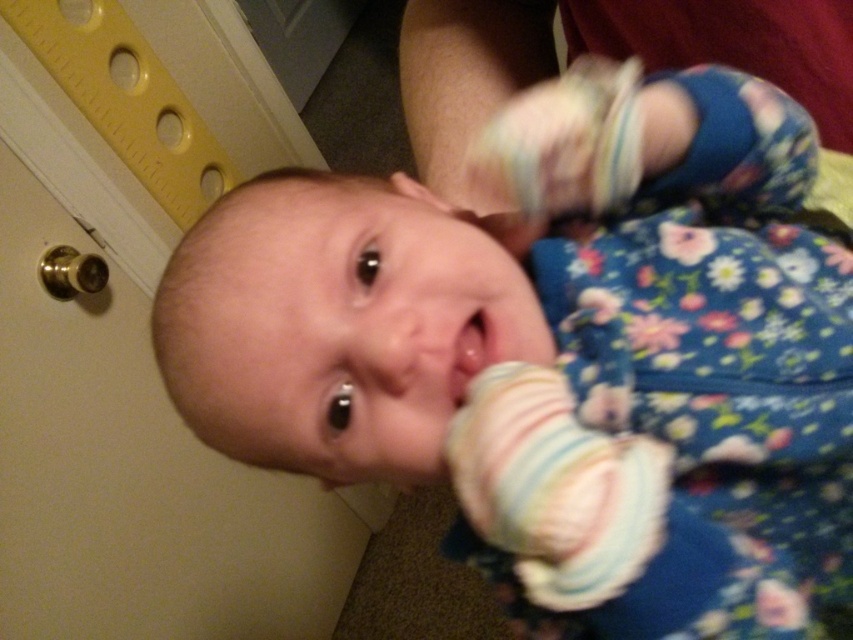
You are a photographer taking a closeup shot of a baby. You notice the floral fabric baby foot at center and the smooth flesh mouth at center. From the baby s perspective, which object is on the left side?

The smooth flesh mouth at center is on the left side from the baby s perspective because the floral fabric baby foot at center is to the right of it.

You are a photographer taking a picture of the baby. You notice two points in the image at coordinates point [532,20] and point [459,332]. Which point is closer to you?

Point [532,20] is further to the viewer than point [459,332], so the point closer to you is point [459,332].

Where is the floral fabric baby foot at center located in the image?

The floral fabric baby foot at center is located at point (463,76) in the image.